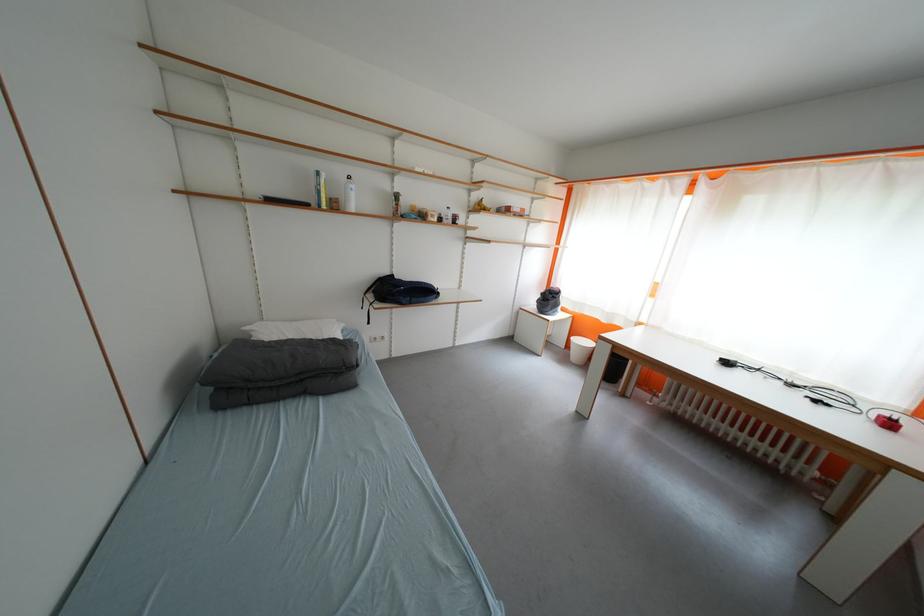
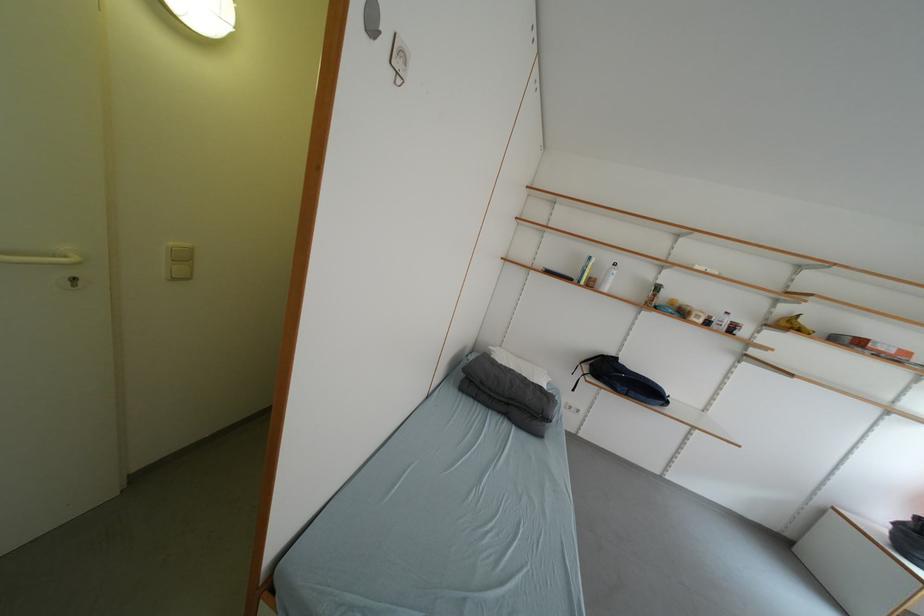
The point at [344,209] is marked in the first image. Where is the corresponding point in the second image?

(600, 286)